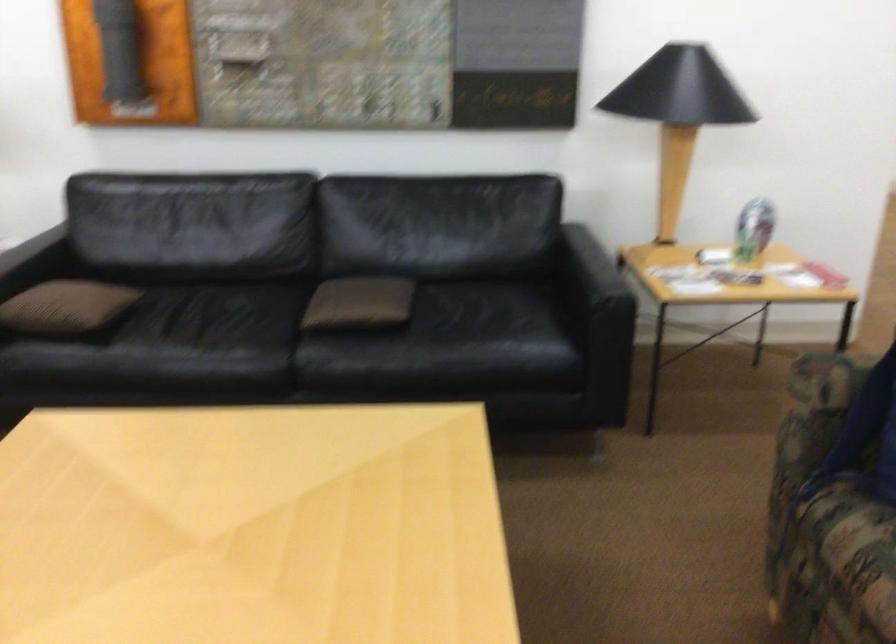
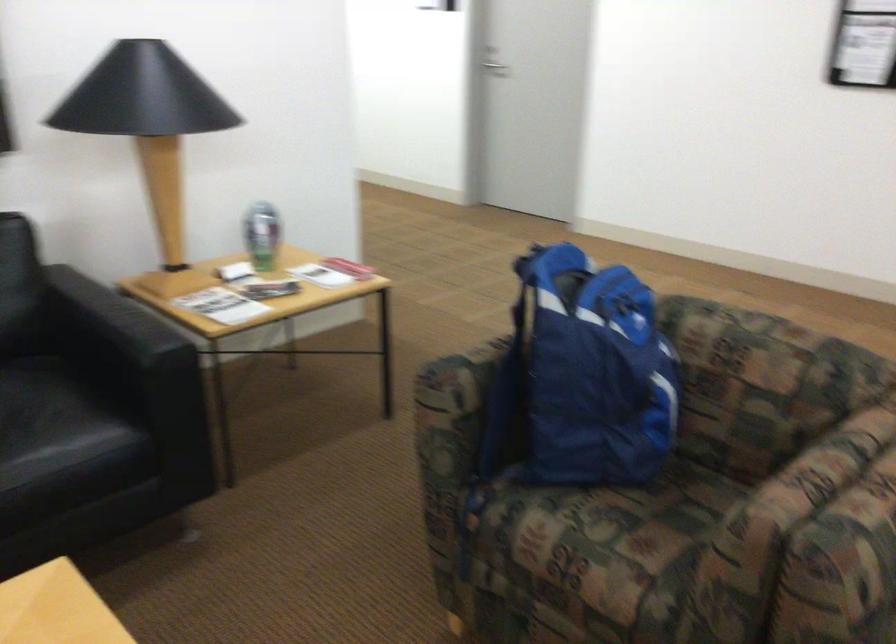
Question: The camera is either moving clockwise (left) or counter-clockwise (right) around the object. The first image is from the beginning of the video and the second image is from the end. Is the camera moving left or right when shooting the video?

Choices:
 (A) Left
 (B) Right

Answer: (A)